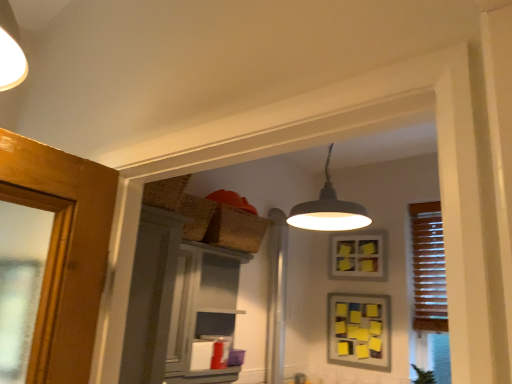
Question: Is woven brown basket at upper center far from yellow sticky notes at upper center, the 1th picture frame in the top-to-bottom sequence?

Choices:
 (A) yes
 (B) no

Answer: (A)

Question: Is woven brown basket at upper center smaller than yellow sticky notes at upper center, the 2th picture frame in the bottom-to-top sequence?

Choices:
 (A) yes
 (B) no

Answer: (B)

Question: Can you confirm if woven brown basket at upper center is bigger than yellow sticky notes at upper center, the 2th picture frame in the bottom-to-top sequence?

Choices:
 (A) yes
 (B) no

Answer: (A)

Question: From a real-world perspective, is woven brown basket at upper center located beneath yellow sticky notes at upper center, the 1th picture frame in the top-to-bottom sequence?

Choices:
 (A) yes
 (B) no

Answer: (B)

Question: Does woven brown basket at upper center have a greater width compared to yellow sticky notes at upper center, the 2th picture frame in the bottom-to-top sequence?

Choices:
 (A) no
 (B) yes

Answer: (B)

Question: Is the position of woven brown basket at upper center less distant than that of yellow sticky notes at upper center, the 1th picture frame in the top-to-bottom sequence?

Choices:
 (A) no
 (B) yes

Answer: (B)

Question: From a real-world perspective, is white glossy cabinet at upper center positioned over yellow sticky notes at upper center, the 1th picture frame in the top-to-bottom sequence, based on gravity?

Choices:
 (A) no
 (B) yes

Answer: (A)

Question: Could you tell me if white glossy cabinet at upper center is turned towards yellow sticky notes at upper center, the 1th picture frame in the top-to-bottom sequence?

Choices:
 (A) yes
 (B) no

Answer: (B)

Question: Does white glossy cabinet at upper center have a lesser height compared to yellow sticky notes at upper center, the 1th picture frame in the top-to-bottom sequence?

Choices:
 (A) no
 (B) yes

Answer: (A)

Question: Considering the relative sizes of white glossy cabinet at upper center and yellow sticky notes at upper center, the 2th picture frame in the bottom-to-top sequence, in the image provided, is white glossy cabinet at upper center thinner than yellow sticky notes at upper center, the 2th picture frame in the bottom-to-top sequence,?

Choices:
 (A) no
 (B) yes

Answer: (A)

Question: Can you confirm if white glossy cabinet at upper center is positioned to the right of yellow sticky notes at upper center, the 2th picture frame in the bottom-to-top sequence?

Choices:
 (A) yes
 (B) no

Answer: (B)

Question: Is the surface of white glossy cabinet at upper center in direct contact with yellow sticky notes at upper center, the 2th picture frame in the bottom-to-top sequence?

Choices:
 (A) no
 (B) yes

Answer: (A)

Question: From a real-world perspective, is matte gray screen door at left located beneath green leafy plant at lower right?

Choices:
 (A) no
 (B) yes

Answer: (A)